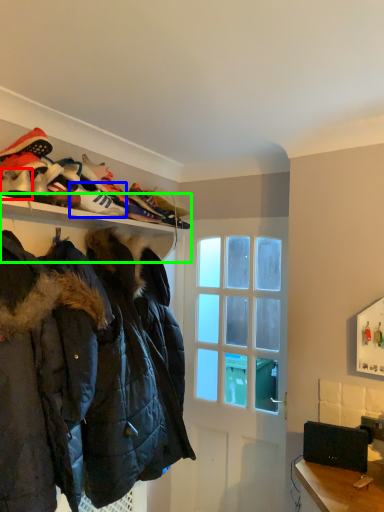
Question: Which object is positioned farthest from footwear (highlighted by a red box)? Select from shoe (highlighted by a blue box) and shelf (highlighted by a green box).

Choices:
 (A) shoe
 (B) shelf

Answer: (B)